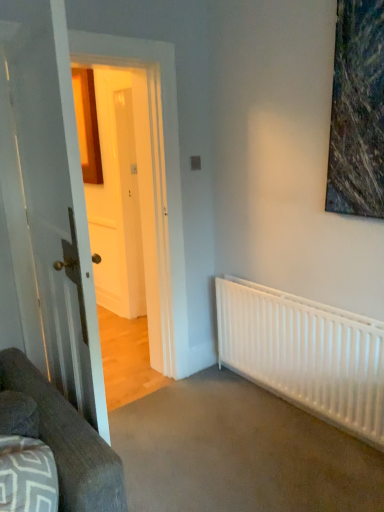
Question: In terms of height, does white glossy door at left look taller or shorter compared to dark gray fabric couch at lower left?

Choices:
 (A) short
 (B) tall

Answer: (B)

Question: From the image's perspective, is white glossy door at left positioned above or below dark gray fabric couch at lower left?

Choices:
 (A) above
 (B) below

Answer: (A)

Question: Based on their relative distances, which object is nearer to the dark gray fabric couch at lower left?

Choices:
 (A) white glossy door at left
 (B) white matte radiator at lower right

Answer: (A)

Question: Which object is the closest to the white matte radiator at lower right?

Choices:
 (A) dark gray fabric couch at lower left
 (B) white glossy door at left

Answer: (B)